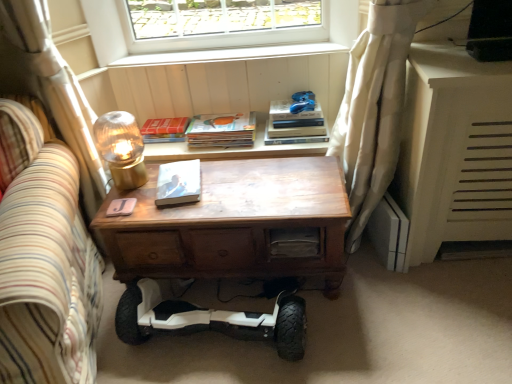
At what (x,y) coordinates should I click in order to perform the action: click on vacant area to the right of wooden desk at center. Please return your answer as a coordinate pair (x, y). Looking at the image, I should click on (408, 311).